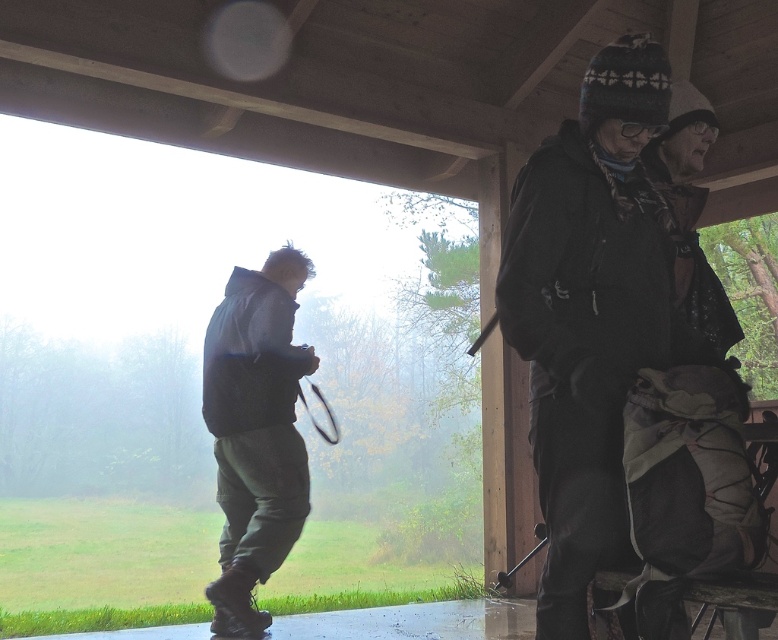
Question: Which of these objects is positioned closest to the black rubber tennis racket at lower left?

Choices:
 (A) dark green pants at left
 (B) dark gray knit hat at upper right

Answer: (A)

Question: Does dark gray knit hat at upper right have a lesser width compared to dark green pants at left?

Choices:
 (A) no
 (B) yes

Answer: (A)

Question: Can you confirm if dark gray knit hat at upper right is positioned above black rubber tennis racket at lower left?

Choices:
 (A) no
 (B) yes

Answer: (B)

Question: Among these points, which one is nearest to the camera?

Choices:
 (A) (591, 323)
 (B) (321, 401)

Answer: (A)

Question: Among these points, which one is farthest from the camera?

Choices:
 (A) (244, 285)
 (B) (307, 412)

Answer: (B)

Question: Is dark gray knit hat at upper right wider than dark green pants at left?

Choices:
 (A) no
 (B) yes

Answer: (B)